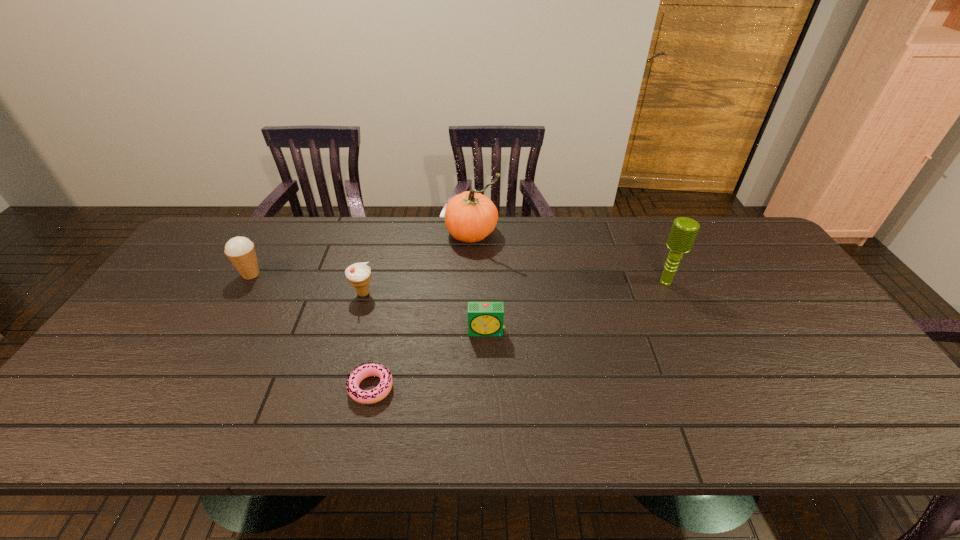
This screenshot has height=540, width=960. In order to click on free space that is in between the doughnut and the second shortest object in this screenshot , I will do `click(429, 360)`.

Find the location of a particular element. vacant area between the alarm clock and the farthest object is located at coordinates (479, 282).

I want to click on free spot between the farther icecream and the microphone, so click(459, 278).

I want to click on vacant area between the farther icecream and the right icecream, so click(x=307, y=284).

This screenshot has height=540, width=960. Find the location of `free space between the left icecream and the fifth tallest object`. free space between the left icecream and the fifth tallest object is located at coordinates (369, 303).

You are a GUI agent. You are given a task and a screenshot of the screen. Output one action in this format:
    pyautogui.click(x=<x>, y=<y>)
    Task: Click on the closest object to the shortest object
    This screenshot has width=960, height=540.
    Given the screenshot: What is the action you would take?
    pyautogui.click(x=484, y=318)

Locate an element on the screen. The width and height of the screenshot is (960, 540). the fourth closest object to the left icecream is located at coordinates (484, 318).

You are a GUI agent. You are given a task and a screenshot of the screen. Output one action in this format:
    pyautogui.click(x=<x>, y=<y>)
    Task: Click on the vacant space that satisfies the following two spatial constraints: 1. on the front side of the right icecream; 2. on the right side of the nearest object
    
    Given the screenshot: What is the action you would take?
    pyautogui.click(x=337, y=388)

Where is `vacant region that satisfies the following two spatial constraints: 1. on the back side of the pumpkin; 2. on the right side of the farther icecream`? vacant region that satisfies the following two spatial constraints: 1. on the back side of the pumpkin; 2. on the right side of the farther icecream is located at coordinates (275, 233).